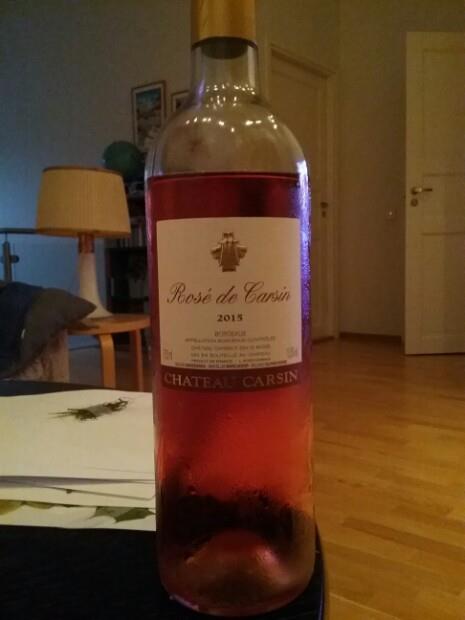
This screenshot has height=620, width=465. What are the coordinates of `white lamp base` in the screenshot? It's located at (92, 266), (101, 311).